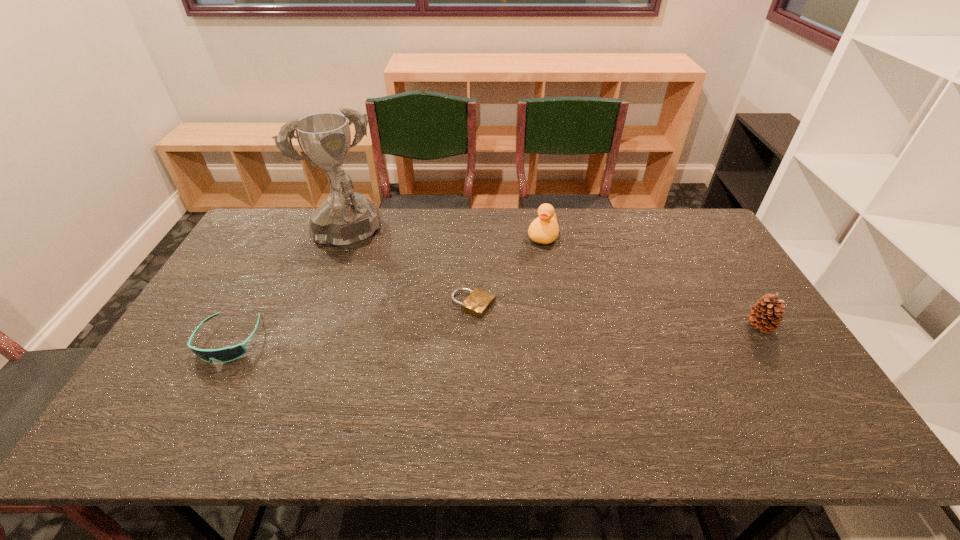
Locate an element on the screen. free space on the desktop that is between the sunglasses and the pinecone and is positioned on the side with emblem of the second object from left to right is located at coordinates (420, 335).

Image resolution: width=960 pixels, height=540 pixels. Identify the location of vacant space on the desktop that is between the fourth tallest object and the rightmost object and is positioned on the keyhole side of the third object from right to left. (537, 332).

Find the location of a particular element. This screenshot has width=960, height=540. vacant space on the desktop that is between the sunglasses and the pinecone and is positioned on the face of the second object from right to left is located at coordinates (510, 333).